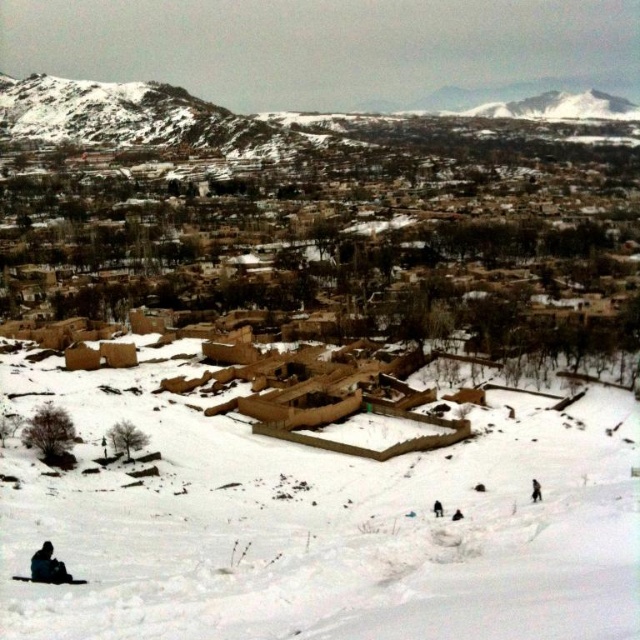
Can you confirm if brown mud-brick village at center is positioned to the right of black fabric person at lower center?

In fact, brown mud-brick village at center is to the left of black fabric person at lower center.

Is brown mud-brick village at center below black fabric person at lower center?

No.

Locate an element on the screen. Image resolution: width=640 pixels, height=640 pixels. brown mud-brick village at center is located at coordinates (330, 264).

Between dark fabric figure at lower left and brown fur coat at lower right, which one has more height?

dark fabric figure at lower left is taller.

In the scene shown: Between dark fabric figure at lower left and brown fur coat at lower right, which one appears on the right side from the viewer's perspective?

Positioned to the right is brown fur coat at lower right.

Image resolution: width=640 pixels, height=640 pixels. What do you see at coordinates (48, 564) in the screenshot?
I see `dark fabric figure at lower left` at bounding box center [48, 564].

This screenshot has height=640, width=640. Find the location of `dark fabric figure at lower left`. dark fabric figure at lower left is located at coordinates (48, 564).

Can you confirm if dark fabric figure at lower left is shorter than black fabric person at lower center?

Incorrect, dark fabric figure at lower left's height does not fall short of black fabric person at lower center's.

Between dark fabric figure at lower left and black fabric person at lower center, which one has more height?

dark fabric figure at lower left is taller.

Between point (49, 572) and point (438, 513), which one is positioned in front?

Point (49, 572) is more forward.

You are a GUI agent. You are given a task and a screenshot of the screen. Output one action in this format:
    pyautogui.click(x=<x>, y=<y>)
    Task: Click on the dark fabric figure at lower left
    
    Given the screenshot: What is the action you would take?
    pyautogui.click(x=48, y=564)